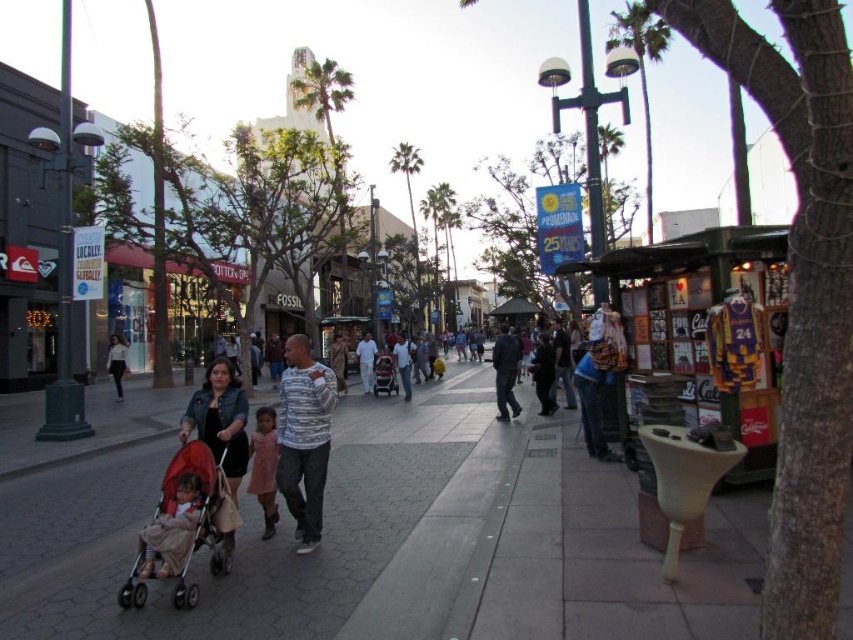
You are a photographer planning to take a portrait of the family in the image. The pink satin dress at center and the matte pink stroller at center are both in the frame. To ensure the dress is visible, where should you position it relative to the stroller?

The pink satin dress at center is positioned under the matte pink stroller at center, so to ensure visibility, the dress should be placed above the stroller in the frame.

You are a delivery person trying to navigate through the sidewalk in the image. You need to pass between the metallic silver display stand at right and the matte pink stroller at center. Can you estimate whether the vertical clearance between these two objects is sufficient for a standard delivery cart that is 1.8 meters tall?

The metallic silver display stand at right is taller than the matte pink stroller at center. Since the display stand is taller, the vertical clearance would depend on the height of the stroller. However, since the stroller is shorter, the clearance might be sufficient. But without exact measurements, it is hard to determine precisely. However, the description only states the relative height between the two objects, not their absolute heights. Therefore, we cannot confirm if the vertical clearance meets the

You are a photographer trying to capture a candid shot of the family without being noticed. The pink satin dress at center and the matte pink stroller at center are in your viewfinder. Which object should you focus on if you want to capture the one closer to the left side of the frame?

The pink satin dress at center is to the left of the matte pink stroller at center, so focusing on it will capture the object closer to the left side of the frame.